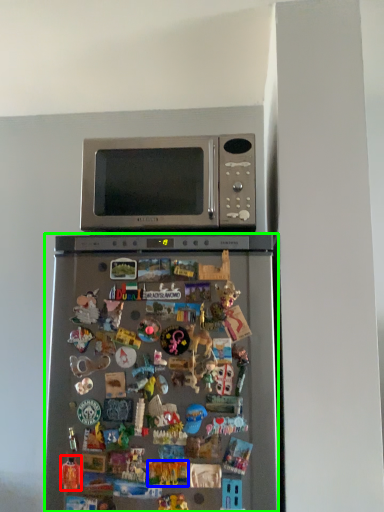
Question: Which is nearer to the toy (highlighted by a red box)? toy (highlighted by a blue box) or refrigerator (highlighted by a green box).

Choices:
 (A) toy
 (B) refrigerator

Answer: (A)